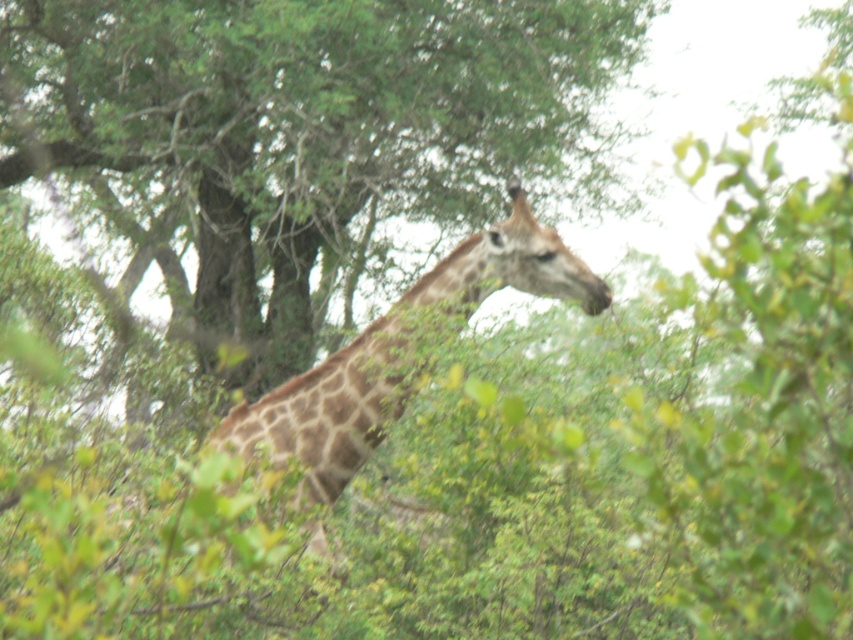
Is green leafy tree at center positioned behind brown spotted giraffe at center?

Yes, it is.

The height and width of the screenshot is (640, 853). I want to click on green leafy tree at center, so [310, 129].

Who is more forward, (256, 262) or (294, 426)?

Point (294, 426)

Locate an element on the screen. The width and height of the screenshot is (853, 640). green leafy tree at center is located at coordinates (310, 129).